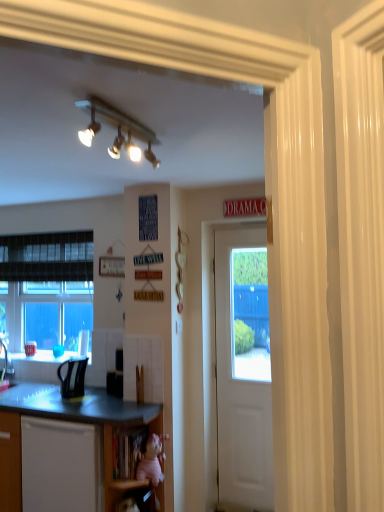
Question: Does white wooden door at center have a lesser width compared to wooden at lower center, which is counted as the 2th shelf, starting from the bottom?

Choices:
 (A) yes
 (B) no

Answer: (A)

Question: Does white wooden door at center turn towards wooden at lower center, which is counted as the 2th shelf, starting from the bottom?

Choices:
 (A) yes
 (B) no

Answer: (B)

Question: Is white wooden door at center not near wooden at lower center, marked as the first shelf in a top-to-bottom arrangement?

Choices:
 (A) no
 (B) yes

Answer: (A)

Question: From a real-world perspective, is white wooden door at center positioned over wooden at lower center, marked as the first shelf in a top-to-bottom arrangement, based on gravity?

Choices:
 (A) no
 (B) yes

Answer: (B)

Question: Is white wooden door at center positioned with its back to wooden at lower center, marked as the first shelf in a top-to-bottom arrangement?

Choices:
 (A) yes
 (B) no

Answer: (B)

Question: Considering the relative sizes of white wooden door at center and wooden at lower center, marked as the first shelf in a top-to-bottom arrangement, in the image provided, is white wooden door at center taller than wooden at lower center, marked as the first shelf in a top-to-bottom arrangement,?

Choices:
 (A) yes
 (B) no

Answer: (A)

Question: Considering the relative sizes of black matte microwave oven at lower center and matte black sink at lower left in the image provided, is black matte microwave oven at lower center thinner than matte black sink at lower left?

Choices:
 (A) yes
 (B) no

Answer: (A)

Question: Is black matte microwave oven at lower center outside of matte black sink at lower left?

Choices:
 (A) yes
 (B) no

Answer: (A)

Question: Could matte black sink at lower left be considered to be inside black matte microwave oven at lower center?

Choices:
 (A) no
 (B) yes

Answer: (A)

Question: Are black matte microwave oven at lower center and matte black sink at lower left far apart?

Choices:
 (A) yes
 (B) no

Answer: (B)

Question: Considering the relative sizes of black matte microwave oven at lower center and matte black sink at lower left in the image provided, is black matte microwave oven at lower center bigger than matte black sink at lower left?

Choices:
 (A) yes
 (B) no

Answer: (B)

Question: Can you confirm if black matte microwave oven at lower center is positioned to the left of matte black sink at lower left?

Choices:
 (A) yes
 (B) no

Answer: (B)

Question: Would you say matte black sink at lower left is outside wooden at lower center, marked as the first shelf in a top-to-bottom arrangement?

Choices:
 (A) yes
 (B) no

Answer: (A)